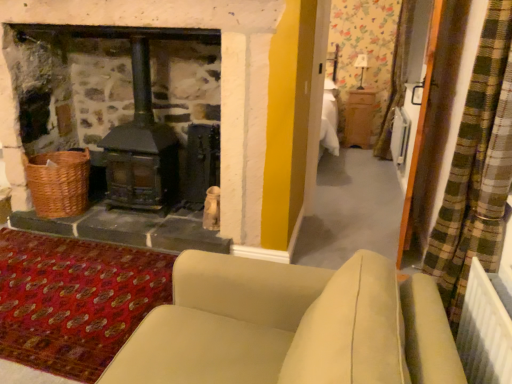
Describe the element at coordinates (291, 326) in the screenshot. I see `beige fabric couch at lower center` at that location.

This screenshot has width=512, height=384. What do you see at coordinates (58, 182) in the screenshot?
I see `woven brown basket at lower left` at bounding box center [58, 182].

I want to click on black matte wood burning stove at left, so click(x=141, y=149).

Can you confirm if white plastic screen door at right is taller than woven brown basket at lower left?

Result: Correct, white plastic screen door at right is much taller as woven brown basket at lower left.

Is white plastic screen door at right at the left side of woven brown basket at lower left?

No, white plastic screen door at right is not to the left of woven brown basket at lower left.

You are a GUI agent. You are given a task and a screenshot of the screen. Output one action in this format:
    pyautogui.click(x=<x>, y=<y>)
    Task: Click on the studio couch located underneath the white plastic screen door at right (from a real-world perspective)
    The image size is (512, 384).
    Given the screenshot: What is the action you would take?
    click(291, 326)

From the image's perspective, is white plastic screen door at right beneath beige fabric couch at lower center?

No, from the image's perspective, white plastic screen door at right is not beneath beige fabric couch at lower center.

Considering the relative sizes of white plastic screen door at right and beige fabric couch at lower center in the image provided, is white plastic screen door at right bigger than beige fabric couch at lower center?

No, white plastic screen door at right is not bigger than beige fabric couch at lower center.

Which is closer, (429, 87) or (205, 356)?

Point (429, 87).

Is white plastic screen door at right at the back of black matte wood burning stove at left?

black matte wood burning stove at left is not turned away from white plastic screen door at right.

Considering the relative positions of black matte wood burning stove at left and white plastic screen door at right in the image provided, is black matte wood burning stove at left to the right of white plastic screen door at right from the viewer's perspective?

In fact, black matte wood burning stove at left is to the left of white plastic screen door at right.

Is black matte wood burning stove at left next to white plastic screen door at right?

No, black matte wood burning stove at left is not with white plastic screen door at right.

How much distance is there between black matte wood burning stove at left and white plastic screen door at right?

They are 1.85 meters apart.

Is point (400, 223) more distant than point (169, 159)?

No, (400, 223) is closer to viewer.

From a real-world perspective, who is located lower, white plastic screen door at right or black matte wood burning stove at left?

In real-world perspective, black matte wood burning stove at left is lower.

This screenshot has height=384, width=512. I want to click on screen door in front of the black matte wood burning stove at left, so click(419, 131).

At what (x,y) coordinates should I click in order to perform the action: click on wood burning stove behind the beige fabric couch at lower center. Please return your answer as a coordinate pair (x, y). Looking at the image, I should click on (141, 149).

Who is smaller, beige fabric couch at lower center or black matte wood burning stove at left?

black matte wood burning stove at left is smaller.

Is beige fabric couch at lower center placed right next to black matte wood burning stove at left?

beige fabric couch at lower center and black matte wood burning stove at left are not in contact.

From the image's perspective, is beige fabric couch at lower center located beneath black matte wood burning stove at left?

Yes, from the image's perspective, beige fabric couch at lower center is below black matte wood burning stove at left.

This screenshot has height=384, width=512. I want to click on studio couch above the woven brown basket at lower left (from a real-world perspective), so click(x=291, y=326).

Considering the sizes of objects woven brown basket at lower left and beige fabric couch at lower center in the image provided, who is smaller, woven brown basket at lower left or beige fabric couch at lower center?

woven brown basket at lower left.

From the picture: Is woven brown basket at lower left wider than beige fabric couch at lower center?

No.

Does beige fabric couch at lower center come in front of woven brown basket at lower left?

That is True.

Between beige fabric couch at lower center and woven brown basket at lower left, which one appears on the left side from the viewer's perspective?

From the viewer's perspective, woven brown basket at lower left appears more on the left side.

From the image's perspective, is beige fabric couch at lower center below woven brown basket at lower left?

Indeed, from the image's perspective, beige fabric couch at lower center is shown beneath woven brown basket at lower left.

Find the location of a particular element. The width and height of the screenshot is (512, 384). basket that is on the left side of white plastic screen door at right is located at coordinates (58, 182).

This screenshot has height=384, width=512. What are the coordinates of `screen door on the right of beige fabric couch at lower center` in the screenshot? It's located at (419, 131).

Which object lies further to the anchor point woven brown basket at lower left, beige fabric couch at lower center or white plastic screen door at right?

white plastic screen door at right lies further to woven brown basket at lower left than the other object.

Which object lies nearer to the anchor point white plastic screen door at right, beige fabric couch at lower center or woven brown basket at lower left?

beige fabric couch at lower center.

Looking at the image, which one is located closer to white plastic screen door at right, black matte wood burning stove at left or beige fabric couch at lower center?

The object closer to white plastic screen door at right is beige fabric couch at lower center.

When comparing their distances from black matte wood burning stove at left, does woven brown basket at lower left or beige fabric couch at lower center seem closer?

woven brown basket at lower left lies closer to black matte wood burning stove at left than the other object.

Which object lies nearer to the anchor point woven brown basket at lower left, black matte wood burning stove at left or white plastic screen door at right?

black matte wood burning stove at left is positioned closer to the anchor woven brown basket at lower left.

Which object lies further to the anchor point black matte wood burning stove at left, woven brown basket at lower left or white plastic screen door at right?

Based on the image, white plastic screen door at right appears to be further to black matte wood burning stove at left.

When comparing their distances from white plastic screen door at right, does black matte wood burning stove at left or woven brown basket at lower left seem further?

woven brown basket at lower left is positioned further to the anchor white plastic screen door at right.

Which object lies further to the anchor point black matte wood burning stove at left, white plastic screen door at right or woven brown basket at lower left?

white plastic screen door at right is positioned further to the anchor black matte wood burning stove at left.

This screenshot has width=512, height=384. Find the location of `wood burning stove between beige fabric couch at lower center and woven brown basket at lower left from front to back`. wood burning stove between beige fabric couch at lower center and woven brown basket at lower left from front to back is located at coordinates (141, 149).

Where is `wood burning stove between woven brown basket at lower left and white plastic screen door at right from left to right`? This screenshot has height=384, width=512. wood burning stove between woven brown basket at lower left and white plastic screen door at right from left to right is located at coordinates (141, 149).

Where is `screen door located between beige fabric couch at lower center and black matte wood burning stove at left in the depth direction`? The width and height of the screenshot is (512, 384). screen door located between beige fabric couch at lower center and black matte wood burning stove at left in the depth direction is located at coordinates (419, 131).

Identify the location of studio couch between woven brown basket at lower left and white plastic screen door at right in the horizontal direction. The width and height of the screenshot is (512, 384). (291, 326).